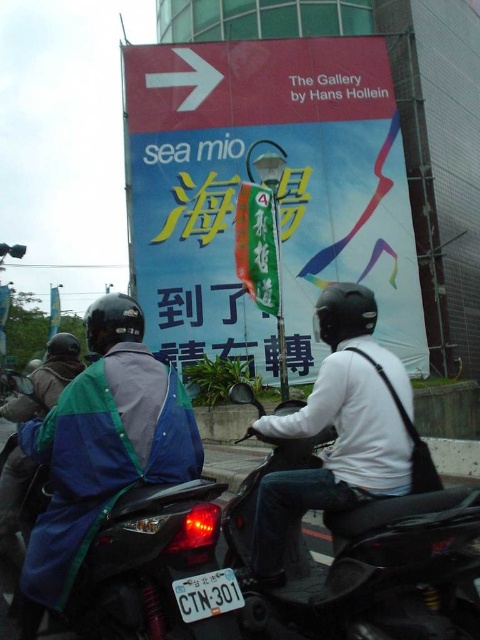
Does point (372, 109) come closer to viewer compared to point (432, 518)?

No, it is behind (432, 518).

Is point (230, 179) positioned after point (289, 406)?

Yes.

Who is more distant from viewer, (x=276, y=346) or (x=474, y=554)?

Result: Positioned behind is point (x=276, y=346).

Find the location of a particular element. This screenshot has height=640, width=480. matte plastic signboard at center is located at coordinates (277, 193).

Does matte blue motorcycle at center have a lesser width compared to white matte helmet at upper center?

No.

Can you confirm if matte blue motorcycle at center is shorter than white matte helmet at upper center?

Yes, matte blue motorcycle at center is shorter than white matte helmet at upper center.

Based on the photo, who is more distant from viewer, (164, 577) or (384, 396)?

Positioned behind is point (384, 396).

This screenshot has width=480, height=640. Find the location of `matte blue motorcycle at center`. matte blue motorcycle at center is located at coordinates (137, 541).

Can you confirm if matte blue motorcycle at center is positioned to the left of black matte motorcycle at center?

Indeed, matte blue motorcycle at center is positioned on the left side of black matte motorcycle at center.

Between point (49, 580) and point (347, 586), which one is positioned behind?

Positioned behind is point (49, 580).

Which is behind, point (66, 545) or point (467, 515)?

Point (66, 545)

Image resolution: width=480 pixels, height=640 pixels. Identify the location of matte blue motorcycle at center. (137, 541).